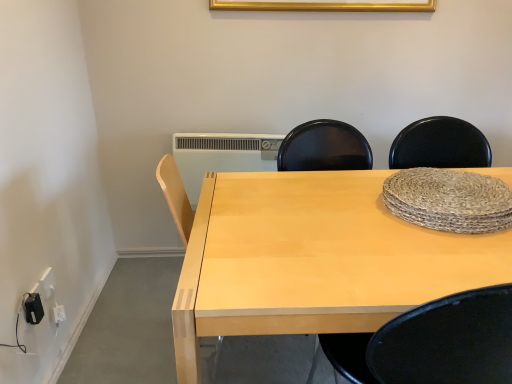
Question: From the image's perspective, does gold metallic picture frame at upper center appear higher than white plastic radiator at center?

Choices:
 (A) yes
 (B) no

Answer: (A)

Question: From the image's perspective, is gold metallic picture frame at upper center beneath white plastic radiator at center?

Choices:
 (A) yes
 (B) no

Answer: (B)

Question: Considering the relative sizes of gold metallic picture frame at upper center and white plastic radiator at center in the image provided, is gold metallic picture frame at upper center bigger than white plastic radiator at center?

Choices:
 (A) yes
 (B) no

Answer: (B)

Question: Would you say white plastic radiator at center is part of gold metallic picture frame at upper center's contents?

Choices:
 (A) yes
 (B) no

Answer: (B)

Question: Is gold metallic picture frame at upper center taller than white plastic radiator at center?

Choices:
 (A) yes
 (B) no

Answer: (B)

Question: In the image, is light wood desk at center on the left side or the right side of black plastic electric outlet at lower left, which ranks as the 1th electric outlet in right-to-left order?

Choices:
 (A) right
 (B) left

Answer: (A)

Question: Does point (295, 307) appear closer or farther from the camera than point (31, 297)?

Choices:
 (A) farther
 (B) closer

Answer: (B)

Question: From their relative heights in the image, would you say light wood desk at center is taller or shorter than black plastic electric outlet at lower left, which ranks as the 1th electric outlet in right-to-left order?

Choices:
 (A) tall
 (B) short

Answer: (A)

Question: In terms of width, does light wood desk at center look wider or thinner when compared to black plastic electric outlet at lower left, the 2th electric outlet when ordered from back to front?

Choices:
 (A) thin
 (B) wide

Answer: (B)

Question: Is point (231, 1) closer or farther from the camera than point (217, 155)?

Choices:
 (A) farther
 (B) closer

Answer: (B)

Question: Relative to white plastic radiator at center, is gold metallic picture frame at upper center in front or behind?

Choices:
 (A) behind
 (B) front

Answer: (B)

Question: From the image's perspective, is gold metallic picture frame at upper center located above or below white plastic radiator at center?

Choices:
 (A) below
 (B) above

Answer: (B)

Question: In the image, is gold metallic picture frame at upper center on the left side or the right side of white plastic radiator at center?

Choices:
 (A) left
 (B) right

Answer: (B)

Question: Relative to white plastic electric outlet at lower left, marked as the first electric outlet in a left-to-right arrangement, is light wood desk at center in front or behind?

Choices:
 (A) behind
 (B) front

Answer: (B)

Question: Is point (411, 284) positioned closer to the camera than point (53, 284)?

Choices:
 (A) farther
 (B) closer

Answer: (B)